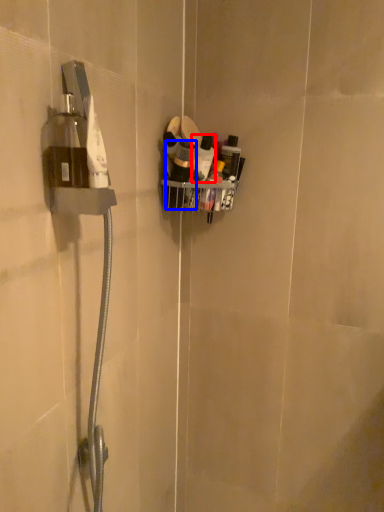
Question: Which object appears farthest to the camera in this image, toiletry (highlighted by a red box) or toiletry (highlighted by a blue box)?

Choices:
 (A) toiletry
 (B) toiletry

Answer: (A)